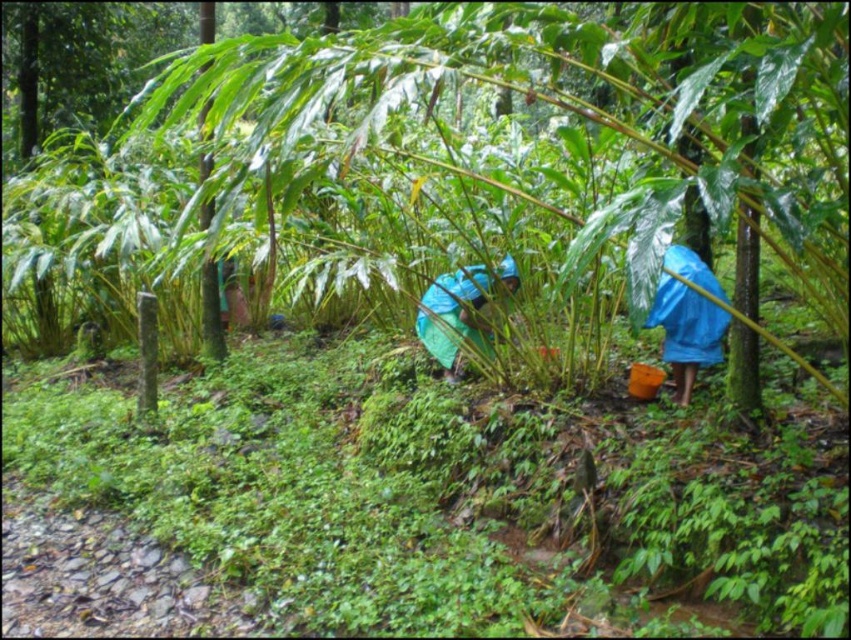
Describe the element at coordinates (688, 317) in the screenshot. I see `blue waterproof jacket at right` at that location.

Who is more forward, [678,372] or [483,276]?

Positioned in front is point [678,372].

Does point (661, 276) come behind point (460, 316)?

No, it is in front of (460, 316).

Identify the location of blue waterproof jacket at right. The image size is (851, 640). (688, 317).